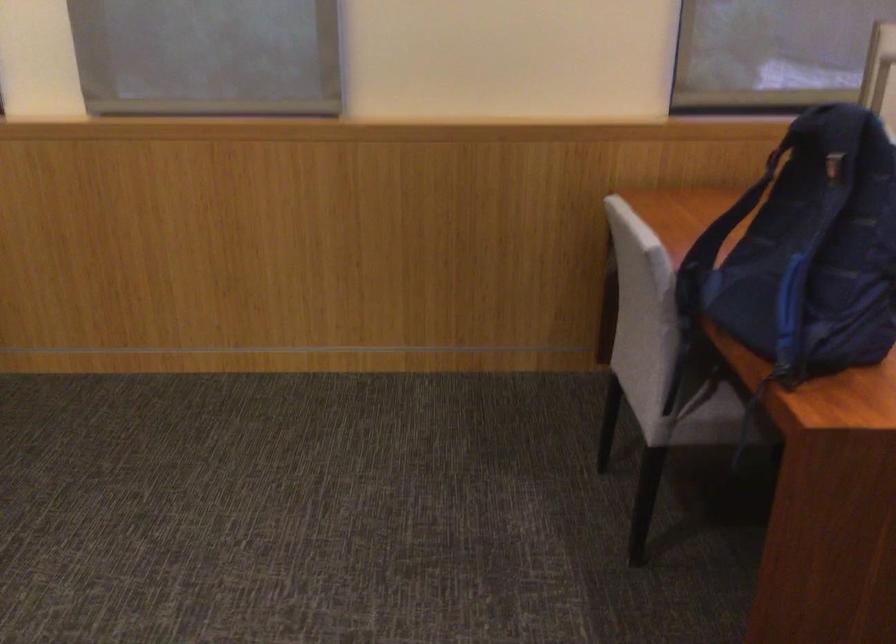
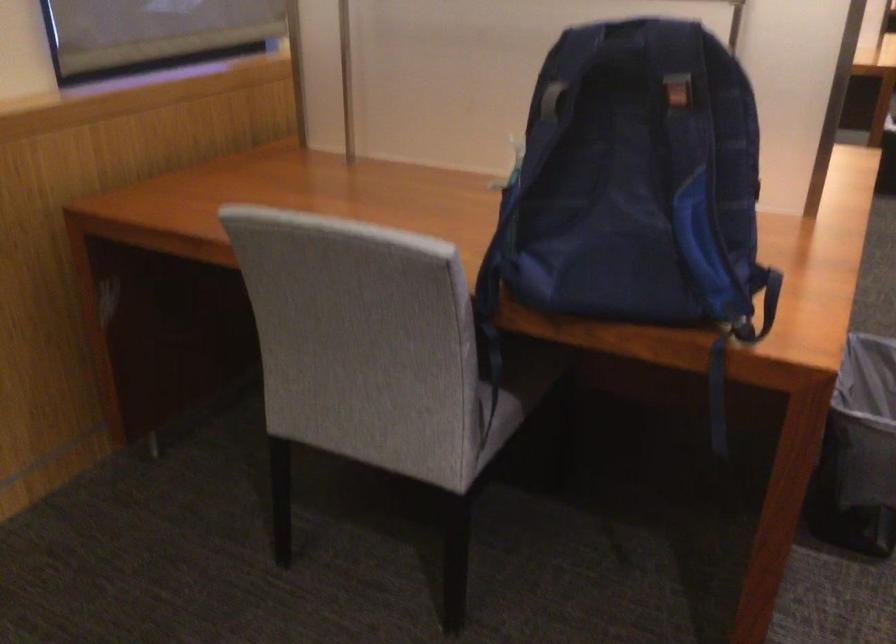
In the second image, find the point that corresponds to (778,164) in the first image.

(552, 100)